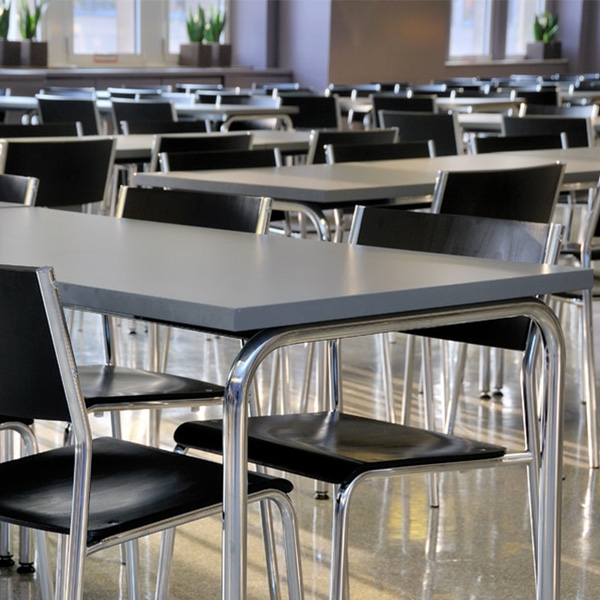
Where is `plant`? The image size is (600, 600). plant is located at coordinates (4, 23), (29, 24), (198, 38), (213, 33), (543, 28).